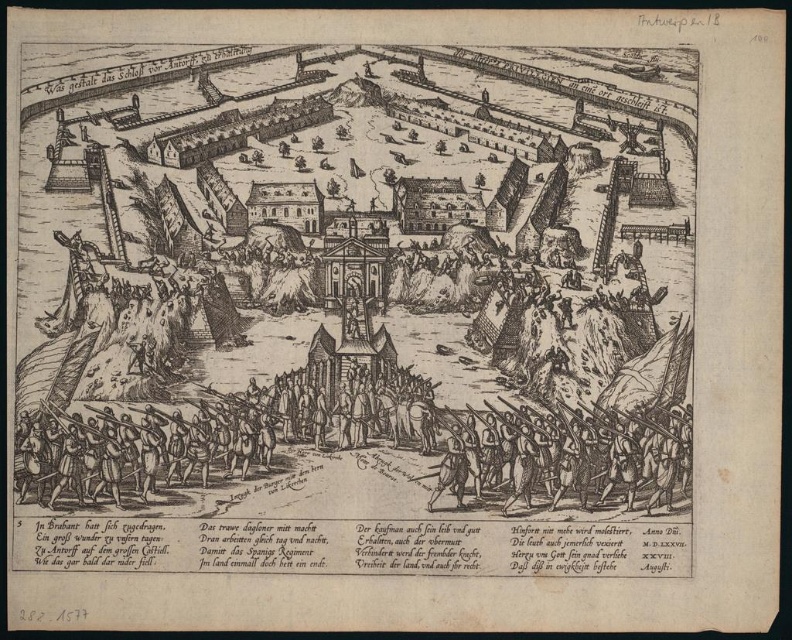
Is wooden soldiers at center thinner than wooden spears at center?

No.

Between wooden soldiers at center and wooden spears at center, which one has more height?

Standing taller between the two is wooden soldiers at center.

Describe the element at coordinates (353, 280) in the screenshot. The width and height of the screenshot is (792, 640). I see `wooden soldiers at center` at that location.

The height and width of the screenshot is (640, 792). What are the coordinates of `wooden soldiers at center` in the screenshot? It's located at (353, 280).

From the picture: Who is positioned more to the left, wooden spears at center or wooden spears at lower center?

From the viewer's perspective, wooden spears at center appears more on the left side.

Can you confirm if wooden spears at center is thinner than wooden spears at lower center?

No.

Is point (440, 424) positioned behind point (638, 426)?

Yes, point (440, 424) is behind point (638, 426).

Locate an element on the screen. This screenshot has width=792, height=640. wooden spears at center is located at coordinates (372, 440).

Is wooden soldiers at center positioned at the back of wooden spears at lower center?

No, it is in front of wooden spears at lower center.

Between wooden soldiers at center and wooden spears at lower center, which one is positioned higher?

wooden soldiers at center

The width and height of the screenshot is (792, 640). What do you see at coordinates (353, 280) in the screenshot?
I see `wooden soldiers at center` at bounding box center [353, 280].

At what (x,y) coordinates should I click in order to perform the action: click on wooden soldiers at center. Please return your answer as a coordinate pair (x, y). Looking at the image, I should click on (353, 280).